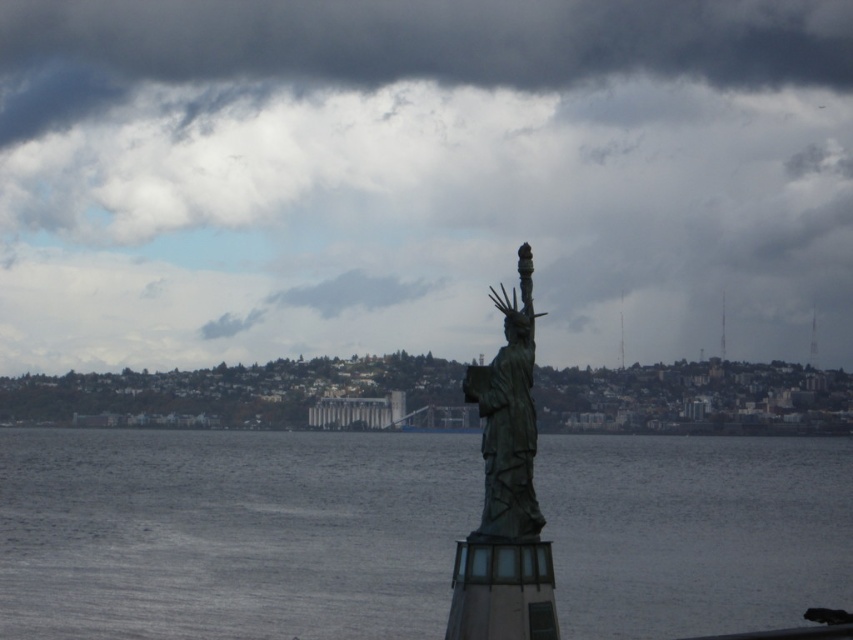
Question: Which point is closer to the camera?

Choices:
 (A) (701, 499)
 (B) (498, 298)

Answer: (B)

Question: Does cloudy sky at upper center appear on the right side of bronze statue at center?

Choices:
 (A) yes
 (B) no

Answer: (A)

Question: Does cloudy sky at upper center appear on the left side of bronze statue at center?

Choices:
 (A) no
 (B) yes

Answer: (A)

Question: Is cloudy sky at upper center smaller than gray metallic water at center?

Choices:
 (A) yes
 (B) no

Answer: (B)

Question: Which object is closer to the camera taking this photo?

Choices:
 (A) cloudy sky at upper center
 (B) gray metallic water at center

Answer: (A)

Question: Which point is farther to the camera?

Choices:
 (A) (398, 612)
 (B) (82, 273)

Answer: (B)